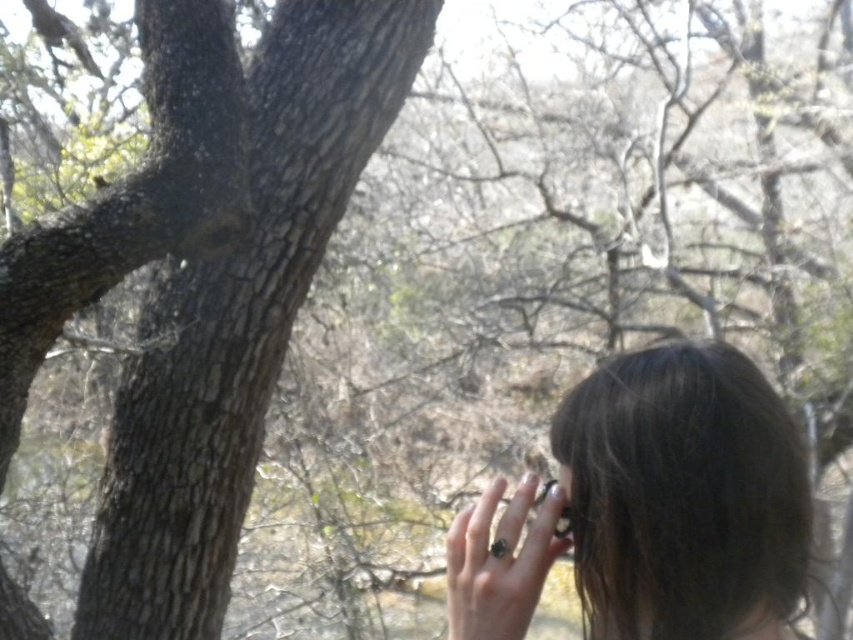
Between black polished ring at center and black glossy ring at lower right, which one appears on the right side from the viewer's perspective?

From the viewer's perspective, black glossy ring at lower right appears more on the right side.

The height and width of the screenshot is (640, 853). What do you see at coordinates (500, 561) in the screenshot? I see `black polished ring at center` at bounding box center [500, 561].

Which is in front, point (467, 620) or point (560, 515)?

Point (467, 620)

At what (x,y) coordinates should I click in order to perform the action: click on black polished ring at center. Please return your answer as a coordinate pair (x, y). Looking at the image, I should click on pyautogui.click(x=500, y=561).

Consider the image. Who is more distant from viewer, (614, 624) or (552, 484)?

Point (552, 484)

Find the location of a particular element. dark brown hair at center is located at coordinates (653, 508).

Is dark brown hair at center positioned at the back of black polished ring at center?

No, dark brown hair at center is closer to the viewer.

Can you confirm if dark brown hair at center is positioned above black polished ring at center?

Actually, dark brown hair at center is below black polished ring at center.

Between point (628, 572) and point (473, 592), which one is positioned in front?

Point (628, 572) is more forward.

This screenshot has height=640, width=853. I want to click on dark brown hair at center, so click(x=653, y=508).